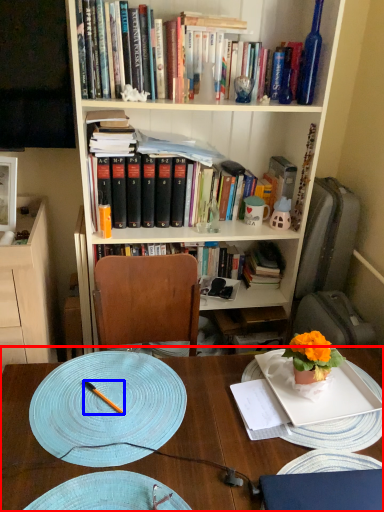
Question: Which point is closer to the camera, desk (highlighted by a red box) or pen (highlighted by a blue box)?

Choices:
 (A) desk
 (B) pen

Answer: (A)